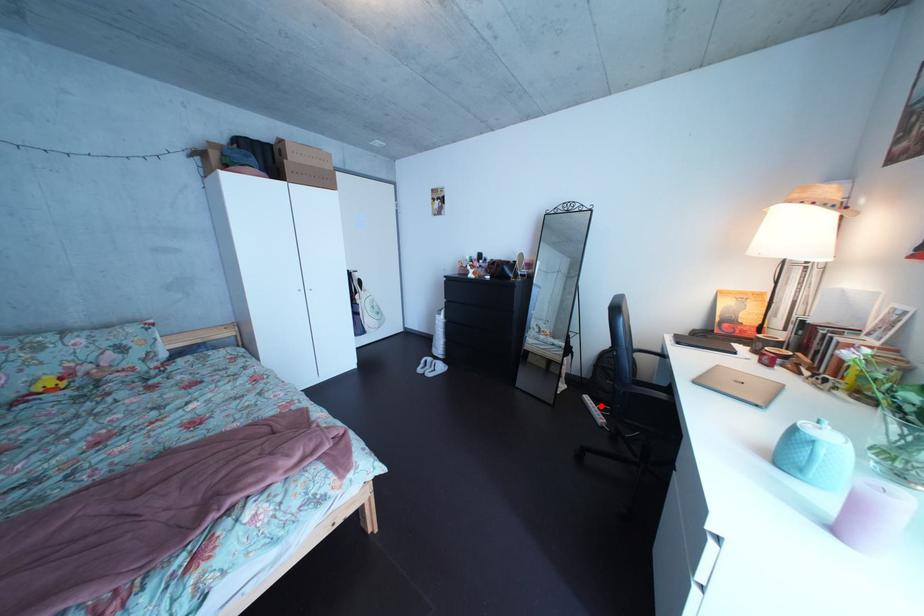
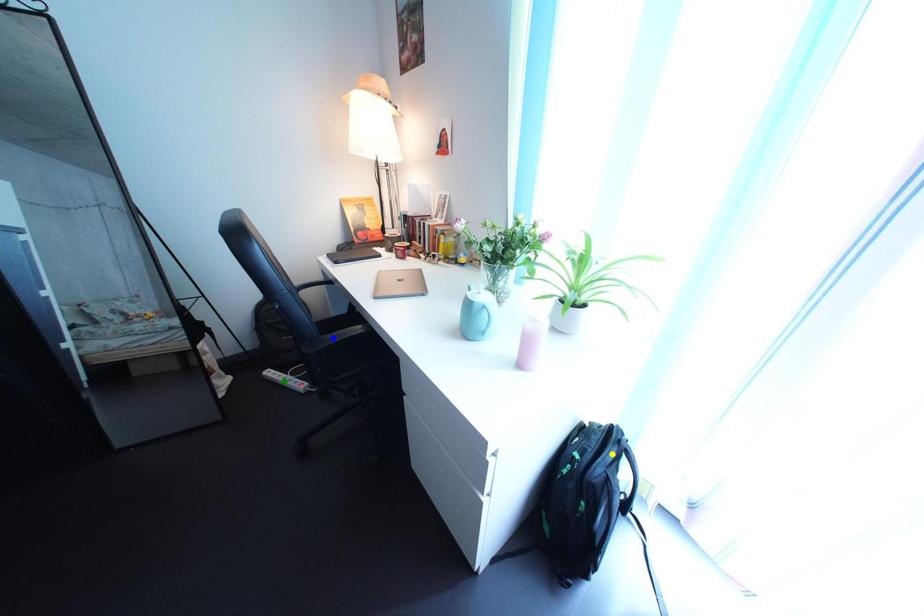
Question: I am providing you with two images of the same scene from different viewpoints. A red point is marked on the first image. You are given multiple points on the second image. Which mark in image 2 goes with the point in image 1?

Choices:
 (A) yellow point
 (B) blue point
 (C) green point

Answer: (C)